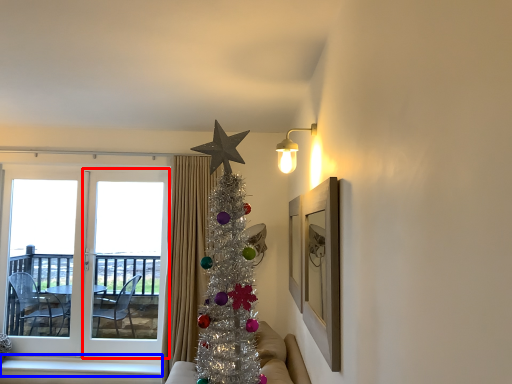
Question: Which of the following is the closest to the observer, screen door (highlighted by a red box) or window sill (highlighted by a blue box)?

Choices:
 (A) screen door
 (B) window sill

Answer: (B)